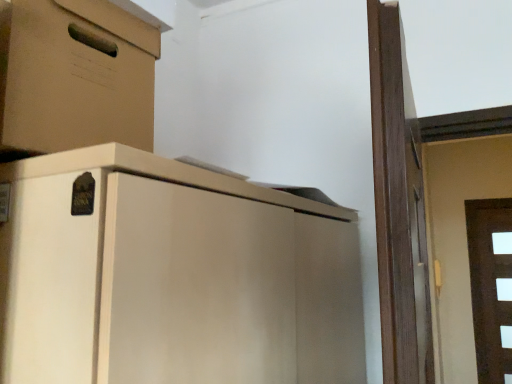
The height and width of the screenshot is (384, 512). What do you see at coordinates (75, 75) in the screenshot?
I see `matte cardboard box at upper left` at bounding box center [75, 75].

Find the location of a particular element. This screenshot has width=512, height=384. matte cardboard box at upper left is located at coordinates (75, 75).

This screenshot has height=384, width=512. Describe the element at coordinates (490, 286) in the screenshot. I see `white glossy door at right` at that location.

Locate an element on the screen. The width and height of the screenshot is (512, 384). white glossy door at right is located at coordinates (490, 286).

The image size is (512, 384). In order to click on matte cardboard box at upper left in this screenshot , I will do `click(75, 75)`.

Which object is positioned more to the left, matte cardboard box at upper left or white glossy door at right?

From the viewer's perspective, matte cardboard box at upper left appears more on the left side.

Which is in front, matte cardboard box at upper left or white glossy door at right?

matte cardboard box at upper left is closer to the camera.

Is point (70, 9) closer or farther from the camera than point (510, 366)?

Point (70, 9) is positioned closer to the camera compared to point (510, 366).

From the image's perspective, is matte cardboard box at upper left located above or below white glossy door at right?

Clearly, from the image's perspective, matte cardboard box at upper left is above white glossy door at right.

From a real-world perspective, is matte cardboard box at upper left physically above white glossy door at right?

Yes, from a real-world perspective, matte cardboard box at upper left is over white glossy door at right

Can you confirm if matte cardboard box at upper left is thinner than white glossy door at right?

No, matte cardboard box at upper left is not thinner than white glossy door at right.

Which of these two, matte cardboard box at upper left or white glossy door at right, stands shorter?

matte cardboard box at upper left is shorter.

Can you confirm if matte cardboard box at upper left is bigger than white glossy door at right?

Yes, matte cardboard box at upper left is bigger than white glossy door at right.

Would you say matte cardboard box at upper left is outside white glossy door at right?

Absolutely, matte cardboard box at upper left is external to white glossy door at right.

Is matte cardboard box at upper left in contact with white glossy door at right?

No.

Consider the image. Does matte cardboard box at upper left turn towards white glossy door at right?

No, matte cardboard box at upper left is not oriented towards white glossy door at right.

How different are the orientations of matte cardboard box at upper left and white glossy door at right in degrees?

matte cardboard box at upper left and white glossy door at right are facing 87.1 degrees away from each other.

How distant is matte cardboard box at upper left from white glossy door at right?

matte cardboard box at upper left is 3.33 meters from white glossy door at right.

You are a GUI agent. You are given a task and a screenshot of the screen. Output one action in this format:
    pyautogui.click(x=<x>, y=<y>)
    Task: Click on the door located below the matte cardboard box at upper left (from the image's perspective)
    This screenshot has height=384, width=512.
    Given the screenshot: What is the action you would take?
    pyautogui.click(x=490, y=286)

Between white glossy door at right and matte cardboard box at upper left, which one appears on the left side from the viewer's perspective?

Positioned to the left is matte cardboard box at upper left.

Is white glossy door at right positioned before matte cardboard box at upper left?

No, white glossy door at right is behind matte cardboard box at upper left.

Which is in front, point (496, 238) or point (49, 68)?

The point (49, 68) is closer to the camera.

From the image's perspective, does white glossy door at right appear lower than matte cardboard box at upper left?

Yes, from the image's perspective, white glossy door at right is beneath matte cardboard box at upper left.

From a real-world perspective, which is physically below, white glossy door at right or matte cardboard box at upper left?

white glossy door at right, from a real-world perspective.

Considering the sizes of white glossy door at right and matte cardboard box at upper left in the image, is white glossy door at right wider or thinner than matte cardboard box at upper left?

In the image, white glossy door at right appears to be more narrow than matte cardboard box at upper left.

Can you confirm if white glossy door at right is taller than matte cardboard box at upper left?

Indeed, white glossy door at right has a greater height compared to matte cardboard box at upper left.

Consider the image. Considering the relative sizes of white glossy door at right and matte cardboard box at upper left in the image provided, is white glossy door at right bigger than matte cardboard box at upper left?

No.

Is white glossy door at right spatially inside matte cardboard box at upper left, or outside of it?

white glossy door at right is spatially situated outside matte cardboard box at upper left.

Is white glossy door at right touching matte cardboard box at upper left?

No, white glossy door at right is not making contact with matte cardboard box at upper left.

Is white glossy door at right positioned with its back to matte cardboard box at upper left?

No, white glossy door at right is not facing away from matte cardboard box at upper left.

How far apart are white glossy door at right and matte cardboard box at upper left?

white glossy door at right and matte cardboard box at upper left are 3.33 meters apart.

Locate an element on the screen. The height and width of the screenshot is (384, 512). door on the right side of matte cardboard box at upper left is located at coordinates (490, 286).

I want to click on door behind the matte cardboard box at upper left, so click(490, 286).

Find the location of a particular element. cabinetry above the white glossy door at right (from the image's perspective) is located at coordinates (75, 75).